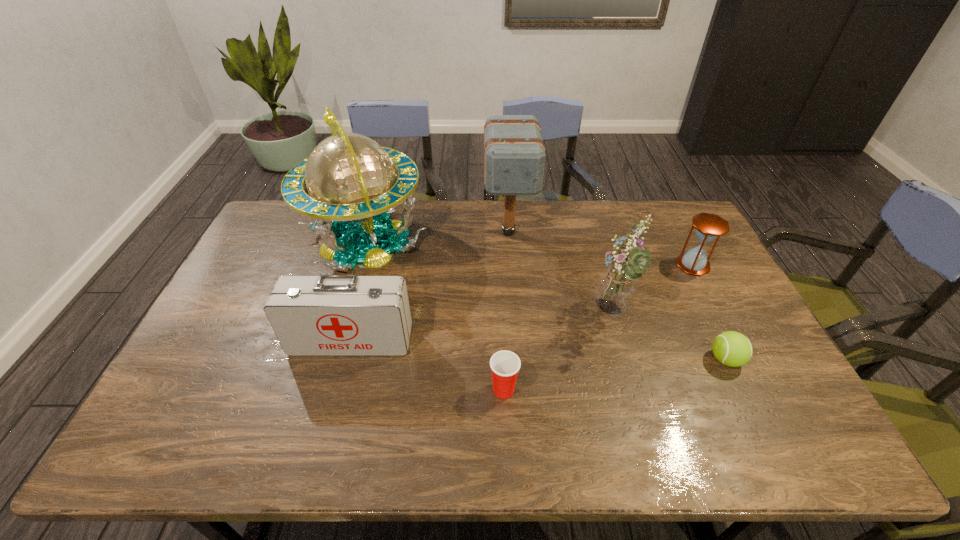
Where is `free region located on the front-facing side of the bouquet`? free region located on the front-facing side of the bouquet is located at coordinates (482, 314).

Identify the location of free space located 0.110m on the front-facing side of the bouquet. (550, 314).

Where is `vacant area situated 0.400m on the front-facing side of the bouquet`? This screenshot has height=540, width=960. vacant area situated 0.400m on the front-facing side of the bouquet is located at coordinates (451, 314).

Locate an element on the screen. The width and height of the screenshot is (960, 540). free region located on the front-facing side of the fourth tallest object is located at coordinates (340, 382).

The width and height of the screenshot is (960, 540). Identify the location of free space located on the left of the fifth tallest object. (652, 265).

Find the location of a particular element. vacant space located 0.300m on the left of the nearest object is located at coordinates (370, 389).

The image size is (960, 540). Identify the location of vacant space positioned 0.080m on the right of the shortest object. (773, 360).

You are a GUI agent. You are given a task and a screenshot of the screen. Output one action in this format:
    pyautogui.click(x=<x>, y=<y>)
    Task: Click on the globe positioned at the far edge
    The width and height of the screenshot is (960, 540).
    Given the screenshot: What is the action you would take?
    pyautogui.click(x=348, y=185)

I want to click on mallet that is at the far edge, so click(514, 154).

Locate an element on the screen. object located in the left edge section of the desktop is located at coordinates (348, 185).